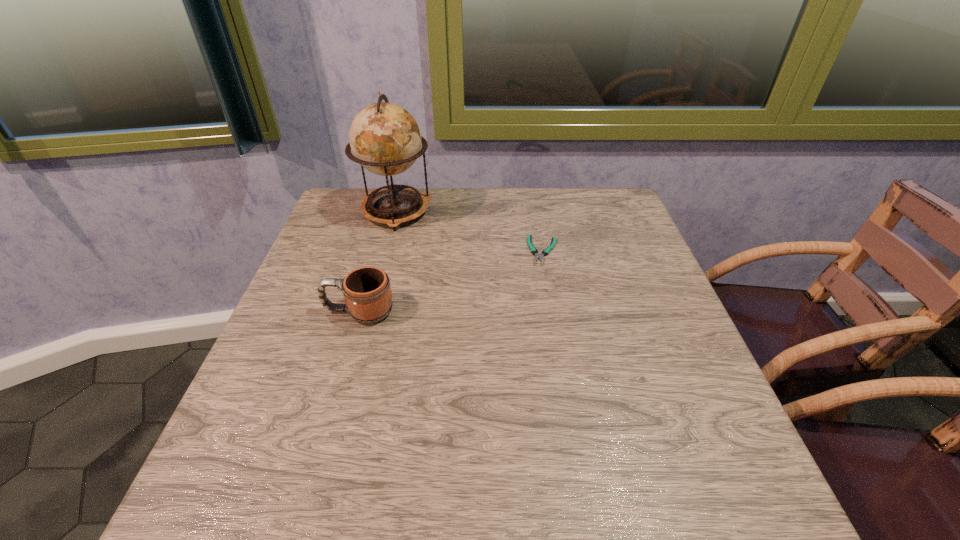
This screenshot has width=960, height=540. Find the location of `the tallest object`. the tallest object is located at coordinates (385, 139).

The width and height of the screenshot is (960, 540). In order to click on globe in this screenshot , I will do `click(385, 139)`.

I want to click on mug, so click(367, 292).

This screenshot has width=960, height=540. What are the coordinates of `the nearest object` in the screenshot? It's located at coord(367,292).

Locate an element on the screen. the rightmost object is located at coordinates coord(534,251).

Locate an element on the screen. The width and height of the screenshot is (960, 540). pliers is located at coordinates (534, 251).

You are a GUI agent. You are given a task and a screenshot of the screen. Output one action in this format:
    pyautogui.click(x=<x>, y=<y>)
    Task: Click on the free location located at the center of the farthest object
    
    Given the screenshot: What is the action you would take?
    pyautogui.click(x=383, y=261)

The image size is (960, 540). Identify the location of free space located 0.120m on the right of the pliers. (607, 251).

The height and width of the screenshot is (540, 960). I want to click on object that is at the far edge, so click(385, 139).

Find the location of `globe positioned at the left edge`. globe positioned at the left edge is located at coordinates (385, 139).